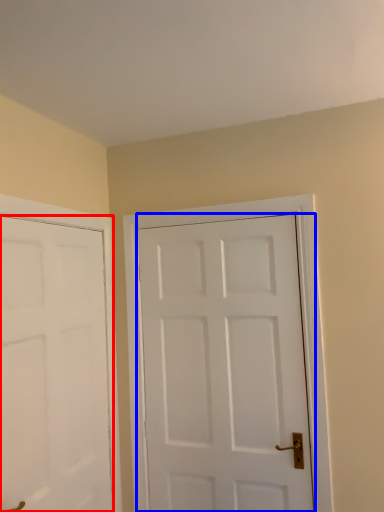
Question: Among these objects, which one is nearest to the camera, door (highlighted by a red box) or door (highlighted by a blue box)?

Choices:
 (A) door
 (B) door

Answer: (A)